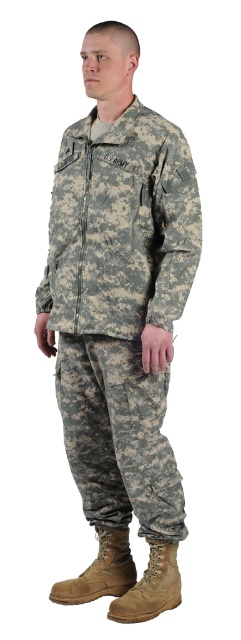
Does camouflage fabric uniform at center have a lesser width compared to tan suede boot at lower center?

No, camouflage fabric uniform at center is not thinner than tan suede boot at lower center.

Between camouflage fabric uniform at center and tan suede boot at lower center, which one is positioned lower?

Positioned lower is tan suede boot at lower center.

Find the location of a particular element. camouflage fabric uniform at center is located at coordinates (120, 323).

The width and height of the screenshot is (241, 640). Identify the location of camouflage fabric uniform at center. point(120,323).

Is tan suede boot at lower center to the left of tan suede boot at lower right from the viewer's perspective?

No, tan suede boot at lower center is not to the left of tan suede boot at lower right.

Does point (172, 589) lie behind point (129, 566)?

No, it is in front of (129, 566).

Describe the element at coordinates (148, 586) in the screenshot. This screenshot has width=241, height=640. I see `tan suede boot at lower center` at that location.

This screenshot has width=241, height=640. Identify the location of tan suede boot at lower center. (148, 586).

Measure the distance between camouflage fabric uniform at center and camera.

The distance of camouflage fabric uniform at center from camera is 1.65 meters.

Is camouflage fabric uniform at center wider than tan suede boot at lower right?

Yes.

Is point (151, 435) positioned in front of point (127, 545)?

Yes, point (151, 435) is closer to viewer.

Where is `camouflage fabric uniform at center`? The image size is (241, 640). camouflage fabric uniform at center is located at coordinates (120, 323).